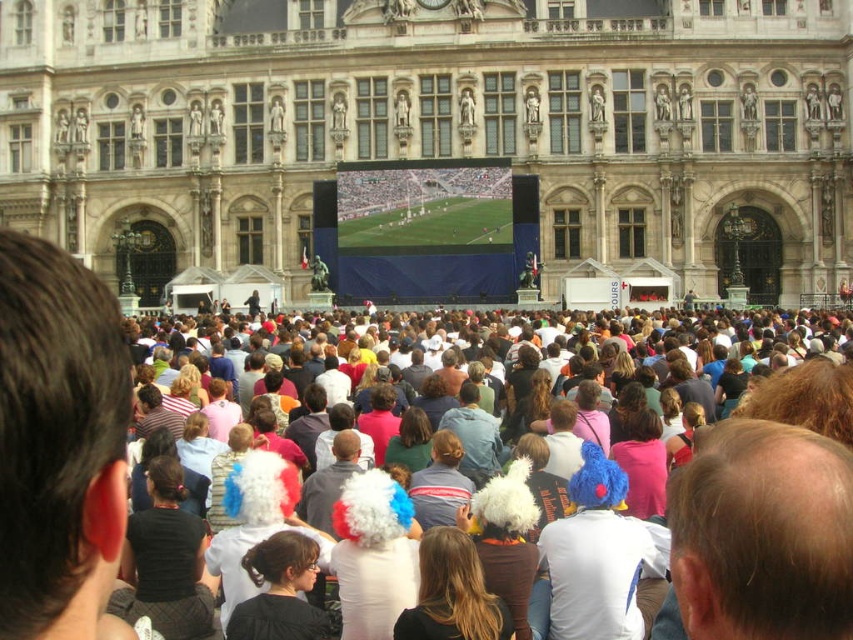
You are a photographer planning to take a photo of the stone facade building at center and the green grass field at center from a distance. Which object should you focus on first if you want to capture both in one frame without zooming in or out?

The stone facade building at center is bigger than the green grass field at center, so you should focus on the stone facade building at center first to ensure it fits properly in the frame before adjusting for the smaller green grass field at center.